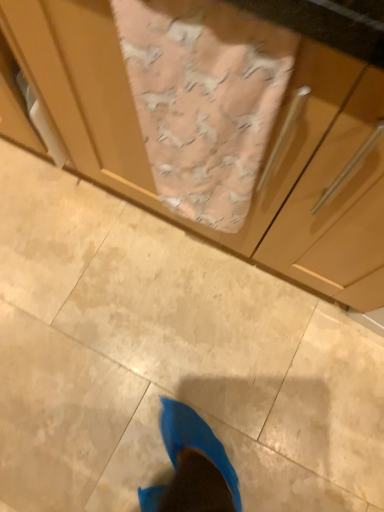
Question: Can matte wood cabinet at center be found inside pink fabric at center?

Choices:
 (A) yes
 (B) no

Answer: (B)

Question: Considering the relative sizes of pink fabric at center and matte wood cabinet at center in the image provided, is pink fabric at center taller than matte wood cabinet at center?

Choices:
 (A) yes
 (B) no

Answer: (B)

Question: Is pink fabric at center with matte wood cabinet at center?

Choices:
 (A) yes
 (B) no

Answer: (B)

Question: From a real-world perspective, is pink fabric at center on top of matte wood cabinet at center?

Choices:
 (A) yes
 (B) no

Answer: (A)

Question: Is pink fabric at center positioned with its back to matte wood cabinet at center?

Choices:
 (A) no
 (B) yes

Answer: (B)

Question: Is pink fabric at center closer to the viewer compared to matte wood cabinet at center?

Choices:
 (A) no
 (B) yes

Answer: (A)

Question: Is matte wood cabinet at center next to pink fabric at center and touching it?

Choices:
 (A) yes
 (B) no

Answer: (B)

Question: Is matte wood cabinet at center far away from pink fabric at center?

Choices:
 (A) yes
 (B) no

Answer: (B)

Question: Considering the relative positions of matte wood cabinet at center and pink fabric at center in the image provided, is matte wood cabinet at center to the left of pink fabric at center from the viewer's perspective?

Choices:
 (A) no
 (B) yes

Answer: (B)

Question: Considering the relative sizes of matte wood cabinet at center and pink fabric at center in the image provided, is matte wood cabinet at center taller than pink fabric at center?

Choices:
 (A) yes
 (B) no

Answer: (A)

Question: From a real-world perspective, is matte wood cabinet at center over pink fabric at center?

Choices:
 (A) yes
 (B) no

Answer: (B)

Question: From the image's perspective, is matte wood cabinet at center on pink fabric at center?

Choices:
 (A) yes
 (B) no

Answer: (A)

Question: From a real-world perspective, is pink fabric at center positioned above or below matte wood cabinet at center?

Choices:
 (A) above
 (B) below

Answer: (A)